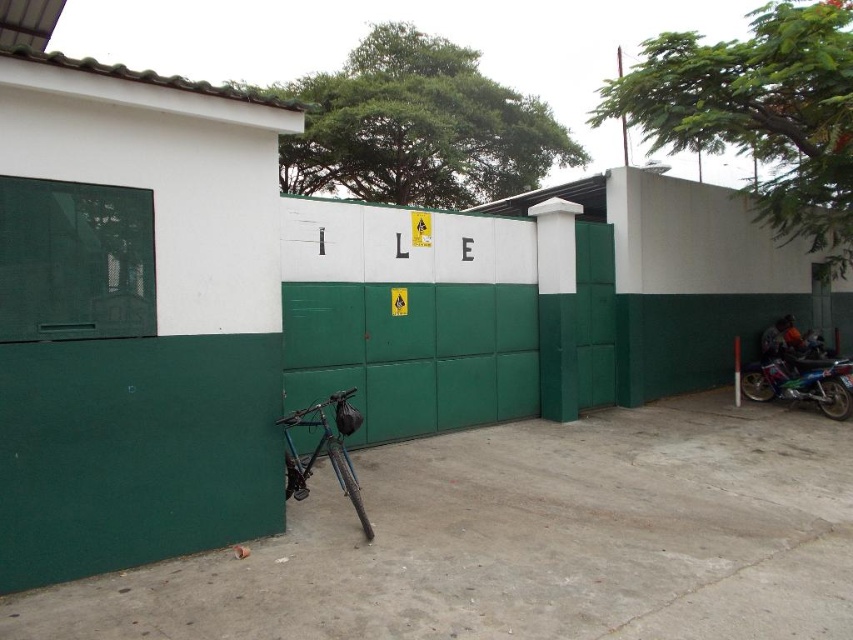
Question: Observing the image, what is the correct spatial positioning of shiny metallic bicycle at center in reference to blue metallic motorcycle at right?

Choices:
 (A) right
 (B) left

Answer: (B)

Question: Which object appears closest to the camera in this image?

Choices:
 (A) shiny metallic bicycle at center
 (B) blue metallic motorcycle at right

Answer: (A)

Question: Where is shiny metallic bicycle at center located in relation to blue metallic motorcycle at right in the image?

Choices:
 (A) right
 (B) left

Answer: (B)

Question: Does shiny metallic bicycle at center appear on the right side of blue metallic motorcycle at right?

Choices:
 (A) no
 (B) yes

Answer: (A)

Question: Which point is closer to the camera?

Choices:
 (A) shiny metallic bicycle at center
 (B) blue metallic motorcycle at right

Answer: (A)